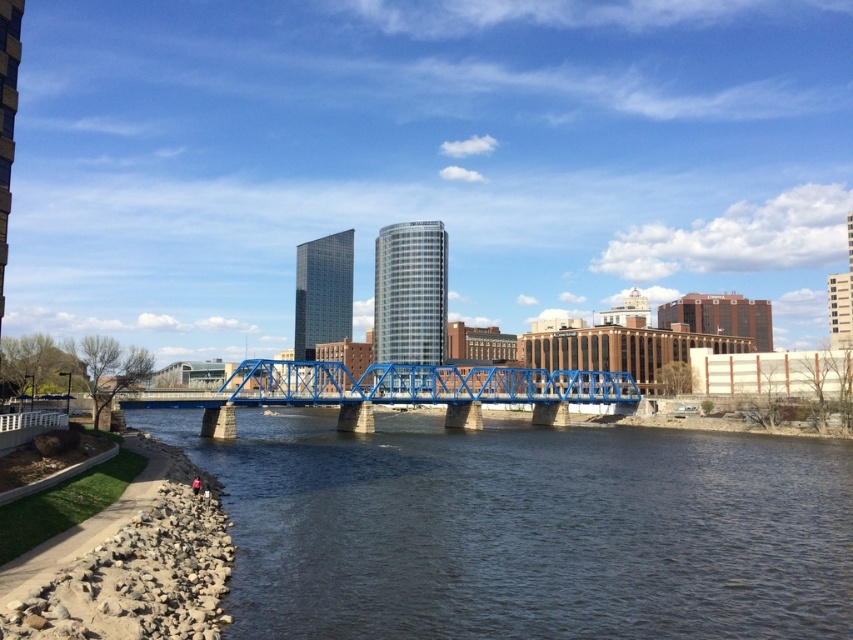
You are a city planner analyzing the image of the urban landscape. Based on the scene, which object takes up more visual space in the image between the dark blue water at lower center and the blue metallic bridge at center?

The blue metallic bridge at center occupies more visual space than the dark blue water at lower center according to the description provided.

You are a city planner examining the image. You need to determine if the dark blue water at lower center can support a small boat that requires a minimum depth of 2 meters. The blue metallic bridge at center has a clearance of 5 meters above the water. Can the boat pass under the bridge?

The dark blue water at lower center is shorter than the blue metallic bridge at center, but the clearance of the bridge is 5 meters above the water. Since the boat requires a minimum depth of 2 meters, the water depth must be at least 2 meters. However, the description only states the water is shorter than the bridge, not the actual depth. Without specific depth information, it is impossible to confirm if the boat can pass safely.

Consider the image. You are a photographer standing on the grassy area bordered by a low wall on the left side of the image. You want to capture a photo that includes both the dark blue water at lower center and the blue metallic bridge at center. Which object should you position closer to the left side of your camera frame?

You should position the dark blue water at lower center closer to the left side of your camera frame because it is located to the left of the blue metallic bridge at center according to the description.